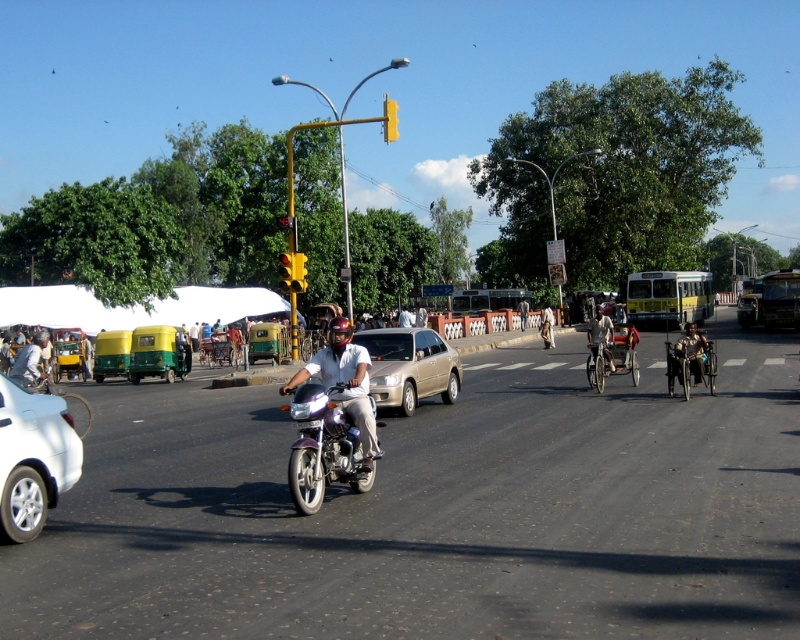
Based on the photo, you are a delivery driver on a narrow alleyway and need to pass both the gold metallic sedan at center and the light beige fabric bicycle at center. Which vehicle should you maneuver around first to ensure you can fit through the narrow space?

You should maneuver around the gold metallic sedan at center first because it has a lesser width compared to the light beige fabric bicycle at center, making it easier to navigate through the narrow alleyway.

You are a delivery person trying to navigate through the traffic. You see the white glossy car at lower left and the gold metallic sedan at center. Which vehicle should you avoid overtaking if you want to stay in the same lane?

You should avoid overtaking the gold metallic sedan at center because the white glossy car at lower left is smaller in size, making it easier to overtake, whereas the gold metallic sedan at center is larger and staying in the same lane would be safer.

You are a delivery driver on a purple motorcycle in the foreground and need to deliver a package to the white glossy car at lower left located at point (34, 458). What is the shortest path you can take to reach the car without crossing any lanes?

The white glossy car at lower left is located at point (34, 458). To reach it, the delivery driver should stay in their current lane and move towards the left side of the road, following the direction of the parked auto rickshaws and avoiding crossing lanes. This path ensures they reach the car safely without crossing any lanes.